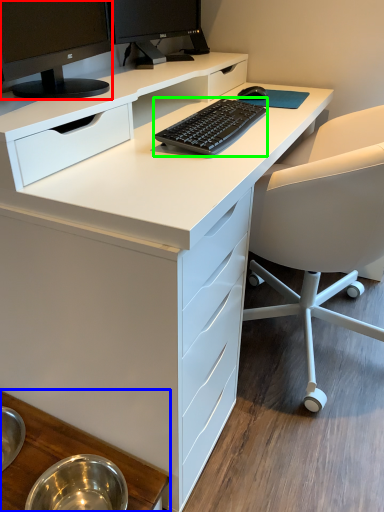
Question: Based on their relative distances, which object is farther from computer monitor (highlighted by a red box)? Choose from table (highlighted by a blue box) and computer keyboard (highlighted by a green box).

Choices:
 (A) table
 (B) computer keyboard

Answer: (A)